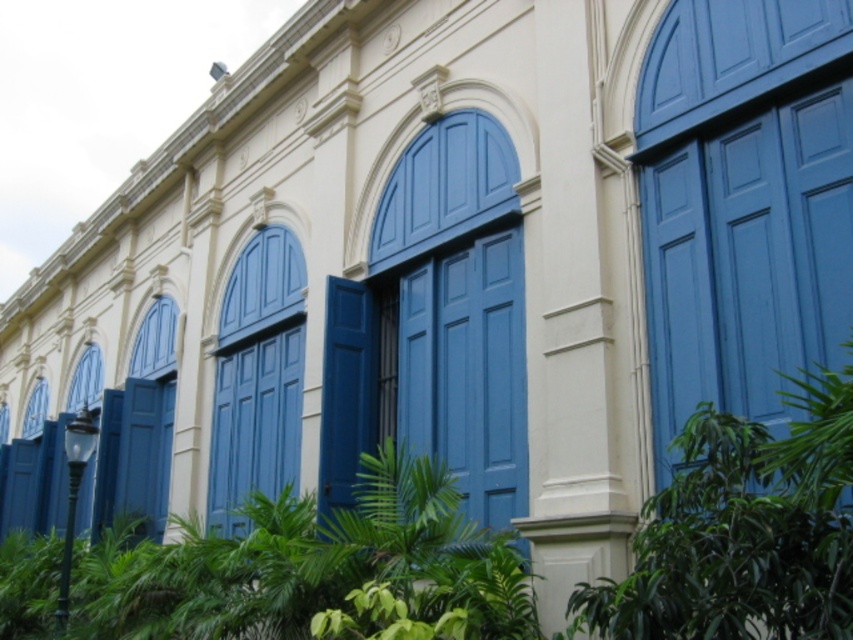
You are standing in front of the building and want to place a small statue between the green leafy plant at lower center and the matte blue window at lower left. Which side of the statue should face the building to ensure it is closer to the taller object?

The green leafy plant at lower center is taller than the matte blue window at lower left. To place the statue closer to the taller object, the side facing the building should be the side nearest to the green leafy plant at lower center.